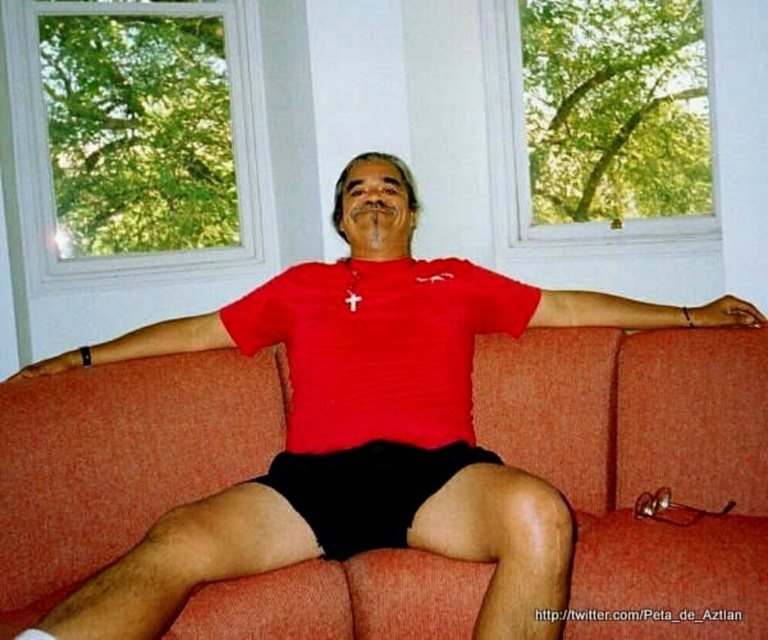
Consider the image. You are a photographer setting up a shoot in the living room. You need to position a small lamp between the orange fabric couch at center and the black matte shorts at center. Based on their positions, where should the lamp be placed relative to the couch and shorts?

The orange fabric couch at center is below the black matte shorts at center, so the lamp should be placed above the orange fabric couch at center and below the black matte shorts at center to position it between them.

You are a delivery person who needs to place a small package on the orange fabric couch at center without disturbing the black matte shorts at center. Where should you place the package?

The orange fabric couch at center is to the right of the black matte shorts at center, so you should place the package on the right side of the orange fabric couch at center to avoid the black matte shorts at center.